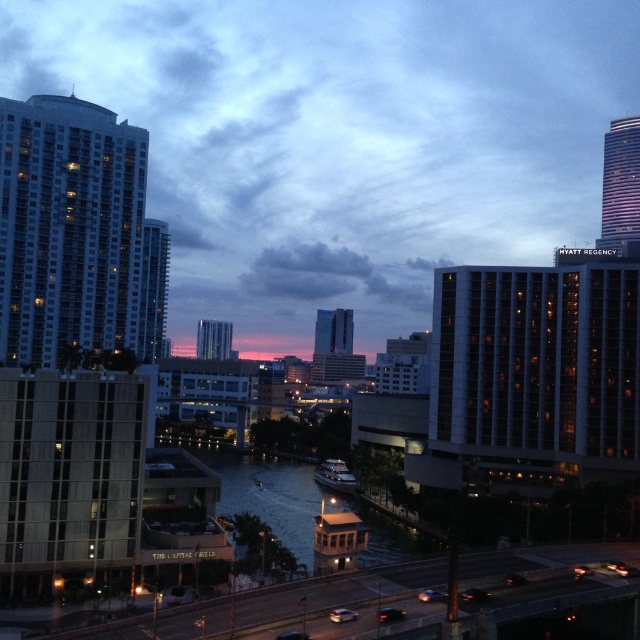
Question: Which of the following is the closest to the observer?

Choices:
 (A) shiny glass skyscraper at upper right
 (B) matte glass skyscraper at center
 (C) matte glass building at left

Answer: (C)

Question: Is greenish water at center thinner than shiny glass skyscraper at upper right?

Choices:
 (A) no
 (B) yes

Answer: (B)

Question: Among these objects, which one is nearest to the camera?

Choices:
 (A) smooth glass skyscraper at center
 (B) shiny glass skyscraper at upper right
 (C) greenish water at center

Answer: (C)

Question: Does matte glass building at center right appear on the left side of greenish water at center?

Choices:
 (A) yes
 (B) no

Answer: (B)

Question: Does matte glass building at center right appear on the left side of smooth glass skyscraper at center?

Choices:
 (A) yes
 (B) no

Answer: (B)

Question: Which of the following is the farthest from the observer?

Choices:
 (A) (612, 128)
 (B) (576, 440)
 (C) (324, 349)

Answer: (C)